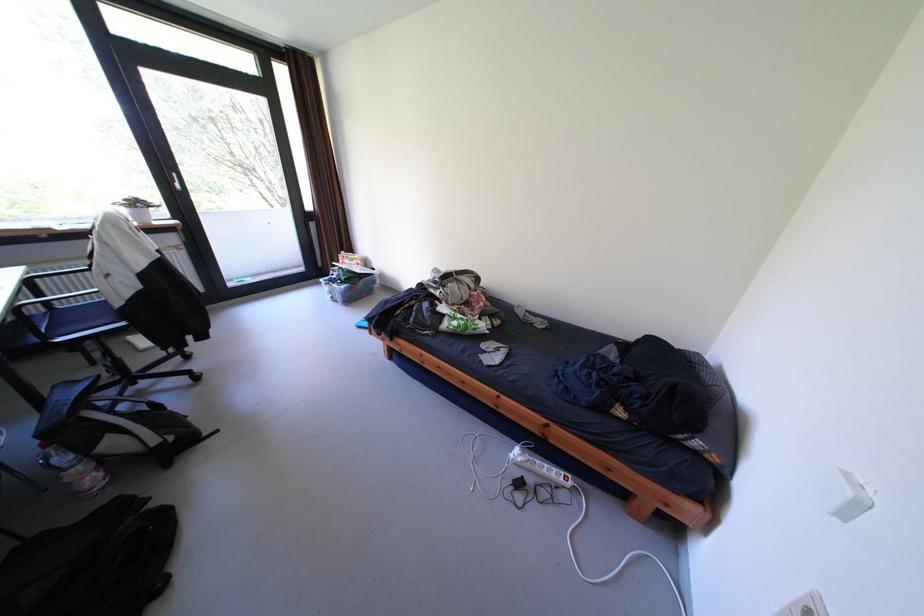
The location [92,562] corresponds to which object?

This point indicates the black backpack.